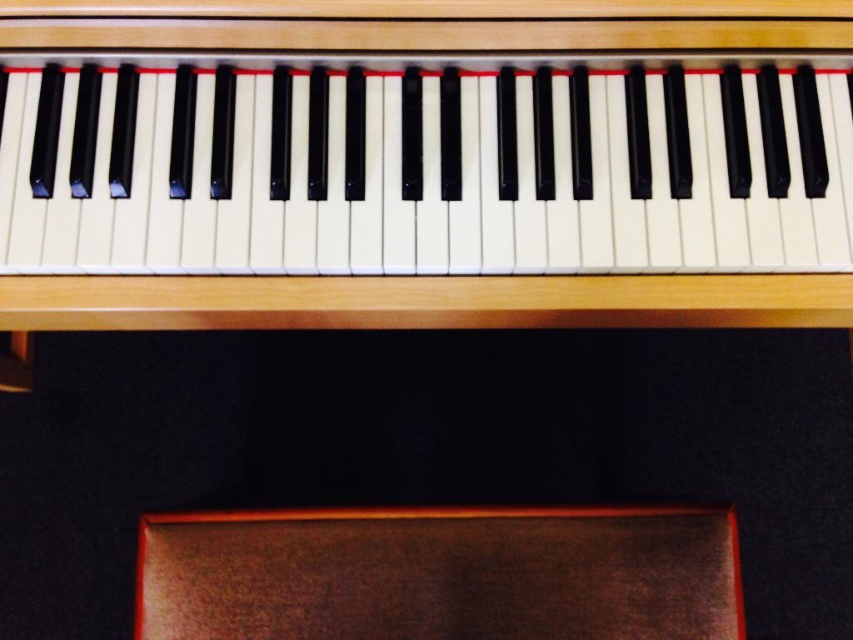
Identify the location of matte black piano keys at upper center. (428, 170).

Is matte black piano keys at upper center smaller than brown leather stool at lower center?

No, matte black piano keys at upper center is not smaller than brown leather stool at lower center.

Between point (199, 193) and point (251, 596), which one is positioned behind?

Point (251, 596)

Find the location of a particular element. The image size is (853, 640). matte black piano keys at upper center is located at coordinates (428, 170).